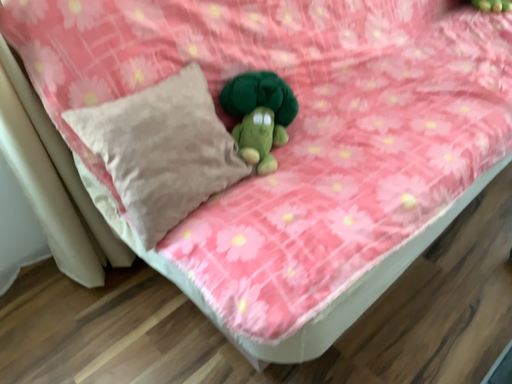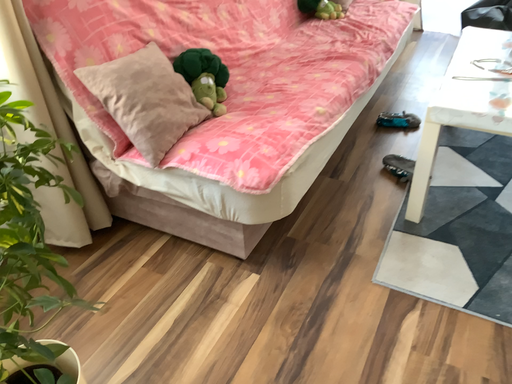
Question: Which way did the camera rotate in the video?

Choices:
 (A) rotated downward
 (B) rotated upward

Answer: (B)